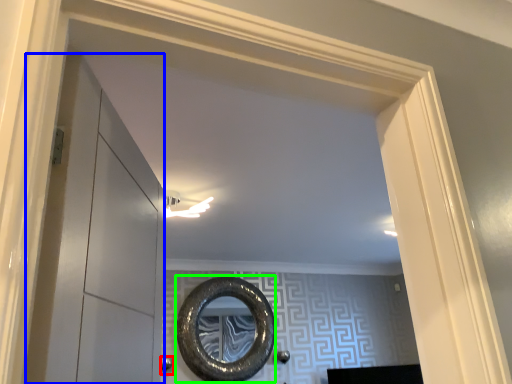
Question: Which is nearer to the door handle (highlighted by a red box)? glass door (highlighted by a blue box) or oval (highlighted by a green box).

Choices:
 (A) glass door
 (B) oval

Answer: (B)